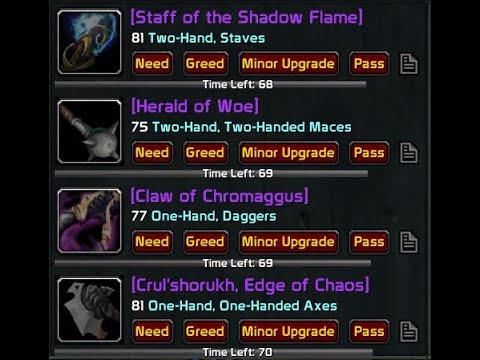
This screenshot has height=360, width=480. Identify the location of background coloring. (23, 98).